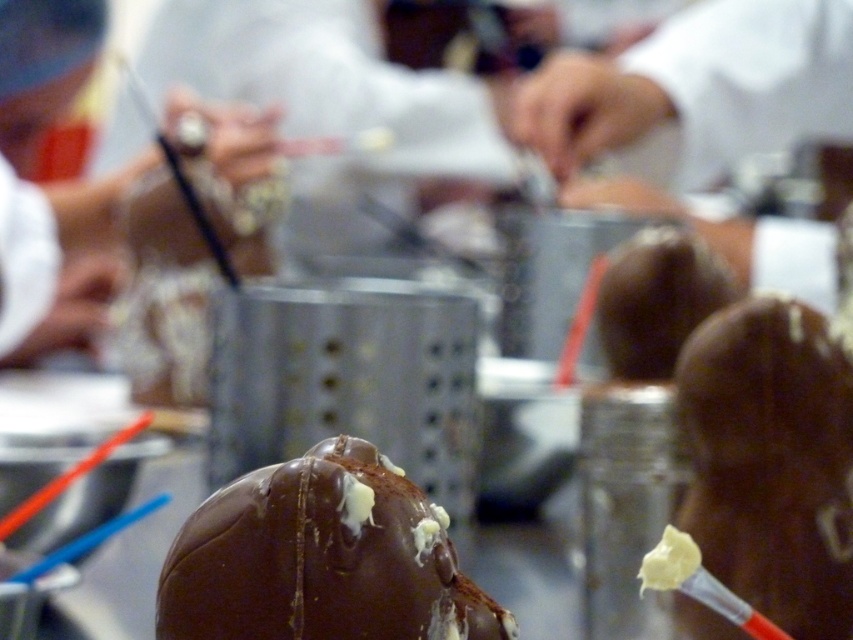
Between shiny chocolate ball at center and shiny chocolate truffle at center, which one is positioned lower?

shiny chocolate ball at center is below.

Measure the distance between shiny chocolate ball at center and shiny chocolate truffle at center.

The distance of shiny chocolate ball at center from shiny chocolate truffle at center is 15.50 inches.

Between point (299, 461) and point (683, 326), which one is positioned behind?

Point (683, 326)

Where is `shiny chocolate ball at center`? The height and width of the screenshot is (640, 853). shiny chocolate ball at center is located at coordinates (321, 557).

Can you confirm if shiny chocolate candy at center is wider than shiny chocolate truffle at center?

In fact, shiny chocolate candy at center might be narrower than shiny chocolate truffle at center.

Can you confirm if shiny chocolate candy at center is positioned below shiny chocolate truffle at center?

Yes, shiny chocolate candy at center is below shiny chocolate truffle at center.

Where is `shiny chocolate candy at center`? shiny chocolate candy at center is located at coordinates (770, 461).

Is shiny chocolate ball at center positioned in front of matte white chef's hat at upper left?

Yes, shiny chocolate ball at center is closer to the viewer.

Between shiny chocolate ball at center and matte white chef's hat at upper left, which one appears on the left side from the viewer's perspective?

Positioned to the left is matte white chef's hat at upper left.

The width and height of the screenshot is (853, 640). In order to click on shiny chocolate ball at center in this screenshot , I will do `click(321, 557)`.

This screenshot has height=640, width=853. Find the location of `shiny chocolate ball at center`. shiny chocolate ball at center is located at coordinates pyautogui.click(x=321, y=557).